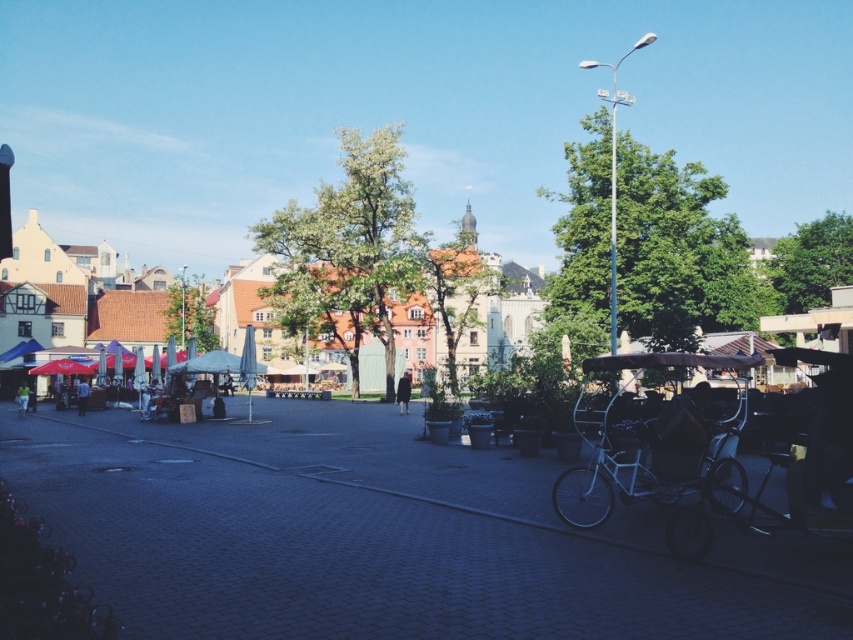
The image size is (853, 640). I want to click on black wool coat at center, so click(x=403, y=392).

Who is taller, black wool coat at center or green fabric umbrella at lower left?

black wool coat at center

Locate an element on the screen. black wool coat at center is located at coordinates (403, 392).

Find the location of a particular element. blue fabric canopy at left is located at coordinates (20, 349).

Is blue fabric canopy at left below green fabric umbrella at lower left?

Actually, blue fabric canopy at left is above green fabric umbrella at lower left.

Is point (19, 355) farther from viewer compared to point (20, 401)?

Yes, point (19, 355) is farther from viewer.

The height and width of the screenshot is (640, 853). What are the coordinates of `blue fabric canopy at left` in the screenshot? It's located at [20, 349].

Between point (741, 420) and point (80, 412), which one is positioned behind?

Point (80, 412)

How distant is metallic silver rickshaw at right from light blue shirt at center?

They are 64.38 meters apart.

Identify the location of metallic silver rickshaw at right. This screenshot has width=853, height=640. (665, 449).